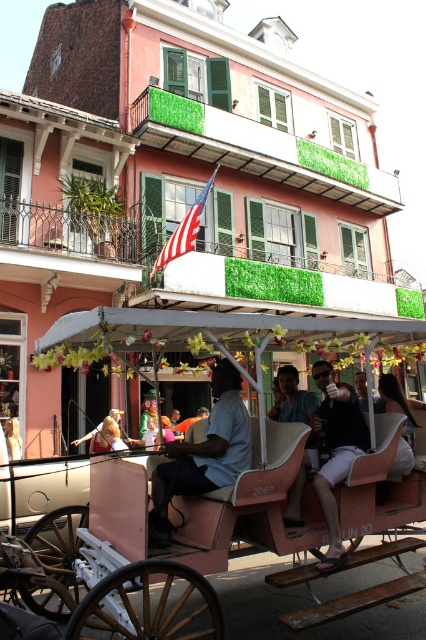
You are standing at the entrance of the street and want to locate the pink matte horse cart at center. Based on the 2D coordinates provided, in which direction should you look to find it?

The pink matte horse cart at center is located at coordinates point [233,340], so you should look towards the center of the image to find it.

Where is the matte blue shirt at center located in the image?

The matte blue shirt at center is located at point (204, 452) in the image.

You are a tourist standing on the street and notice the pink matte horse cart at center and the black matte shirt at center. Which object is located above the other?

The black matte shirt at center is located above the pink matte horse cart at center because the pink matte horse cart at center is positioned under the black matte shirt at center.